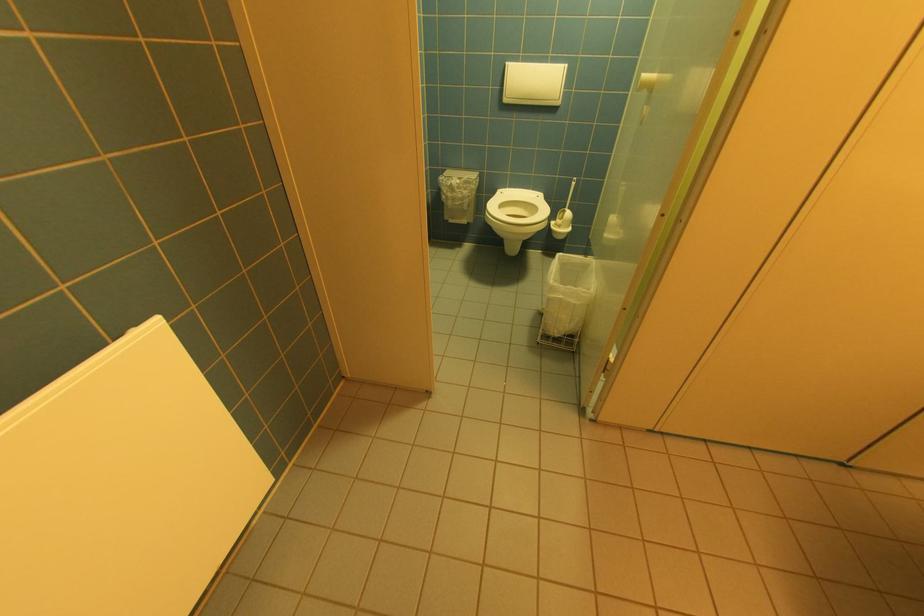
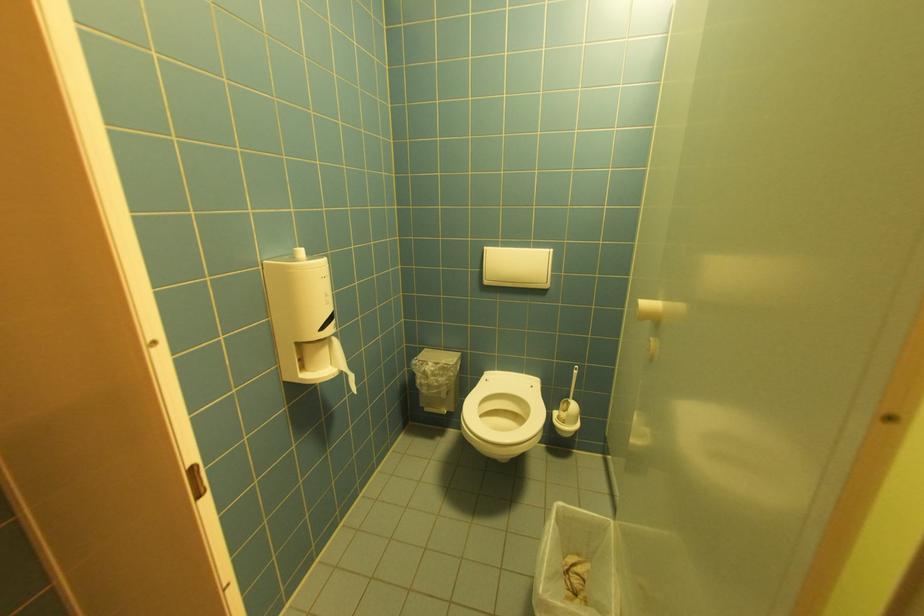
Question: How did the camera likely rotate?

Choices:
 (A) Left
 (B) Right
 (C) Up
 (D) Down

Answer: (C)